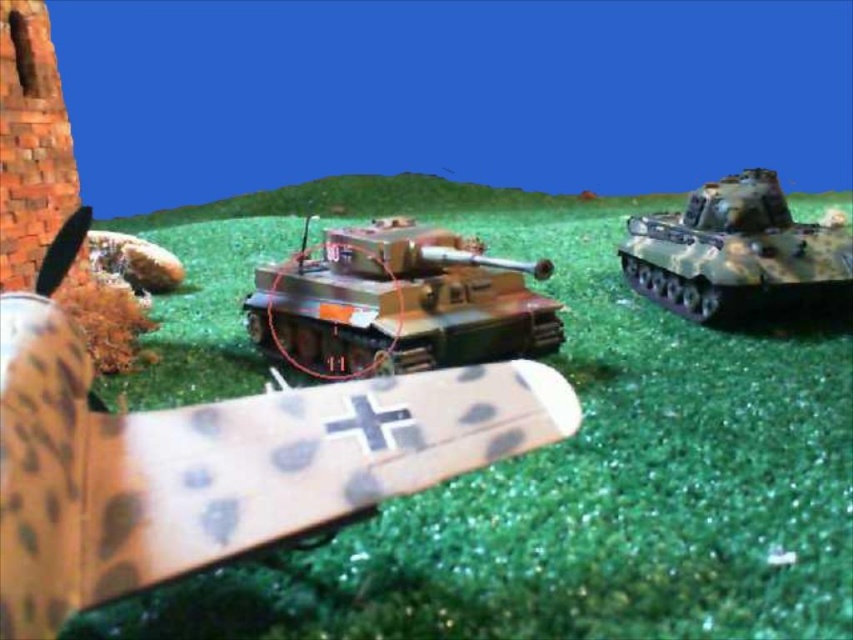
You are a model enthusiast examining the diorama. You notice two tanks labeled as camouflage plastic tank at center and camouflage paint tank at center. Which one is larger in size?

The camouflage plastic tank at center is bigger than the camouflage paint tank at center.

Where is the camouflage paint tank at center located in the image?

The camouflage paint tank at center is located at point 0.475 on the x axis and 0.468 on the y axis.